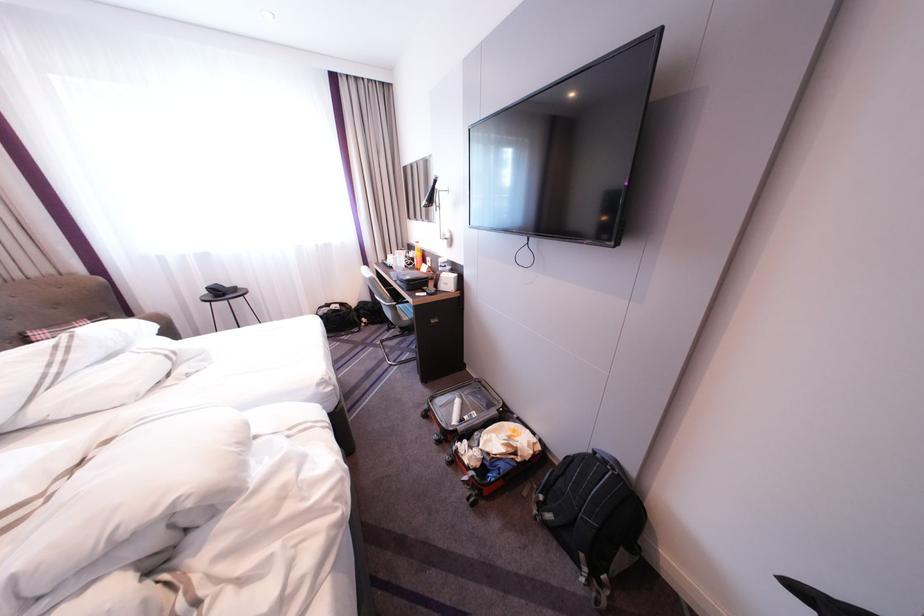
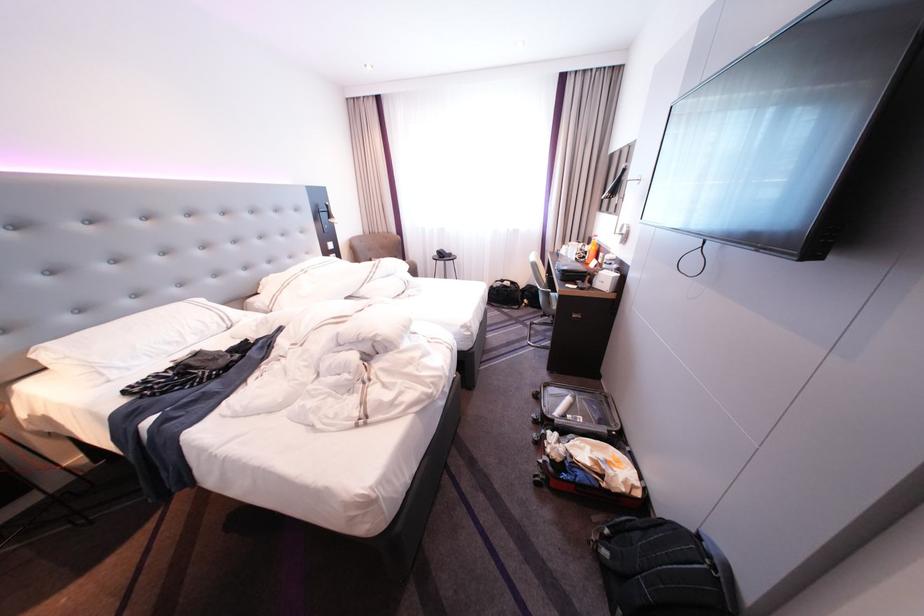
Locate, in the second image, the point that corresponds to the point at 553,517 in the first image.

(610, 548)